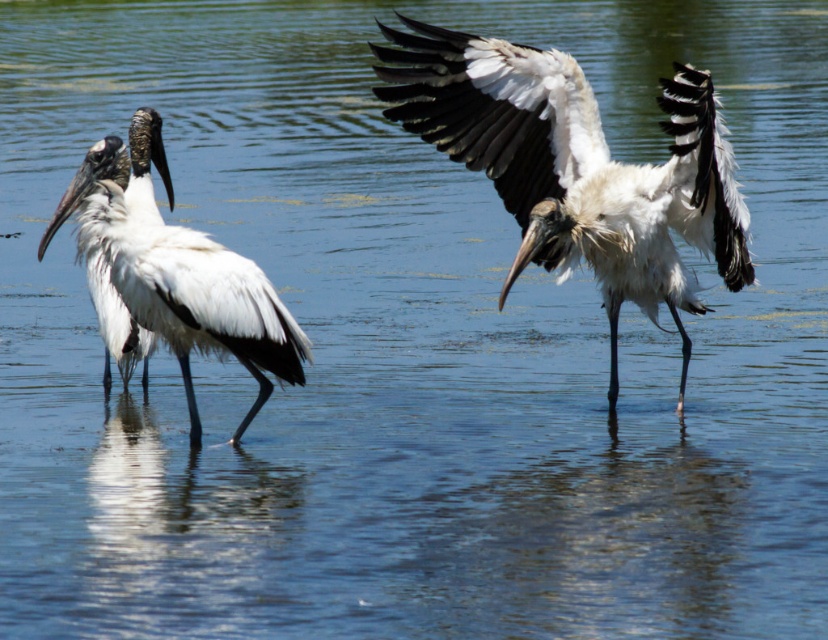
Based on the scene description, where is the white matte bird at center positioned in relation to the other storks?

The white matte bird at center is located at point (576, 168), which is the central focus of the image with its wings spread wide, while the other two storks are positioned to the left, standing close together.

You are a wildlife photographer aiming to capture a closeup of the white matte bird at center and the white matte bird at left. Given that your camera can only focus on one bird at a time, which bird should you choose to ensure the subject is larger in the frame?

The white matte bird at center is bigger than the white matte bird at left, so you should choose the white matte bird at center to ensure the subject is larger in the frame.

You are observing two white matte birds in the image. Which one is positioned closer to you, the white matte bird at center or the white matte bird at left?

The white matte bird at center is closer to the viewer than the white matte bird at left.